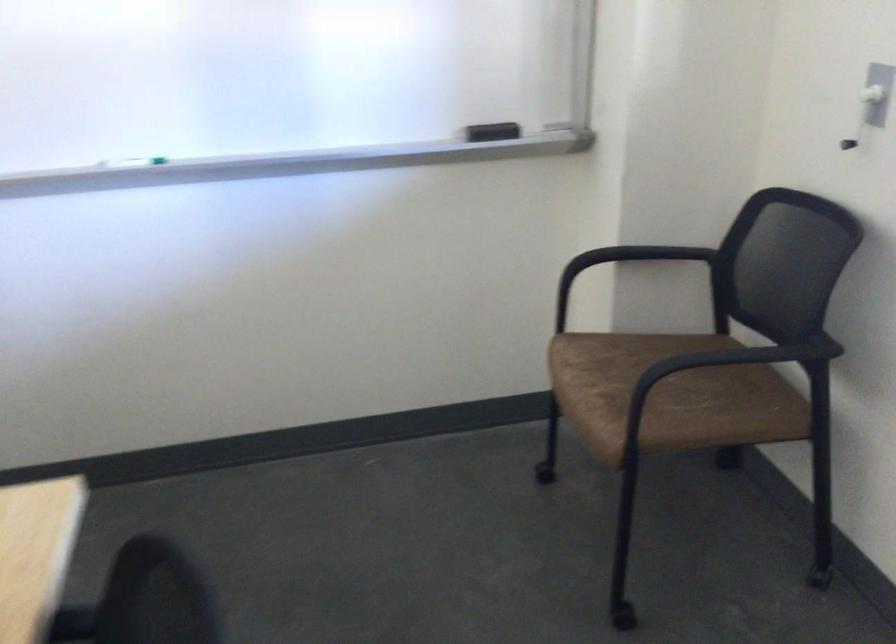
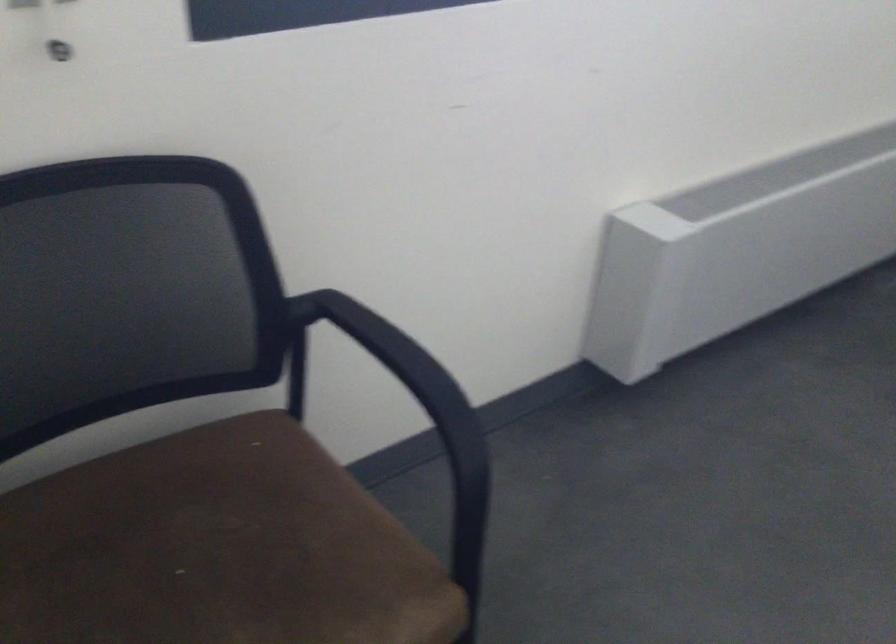
Find the pixel in the second image that matches (681,391) in the first image.

(216, 549)